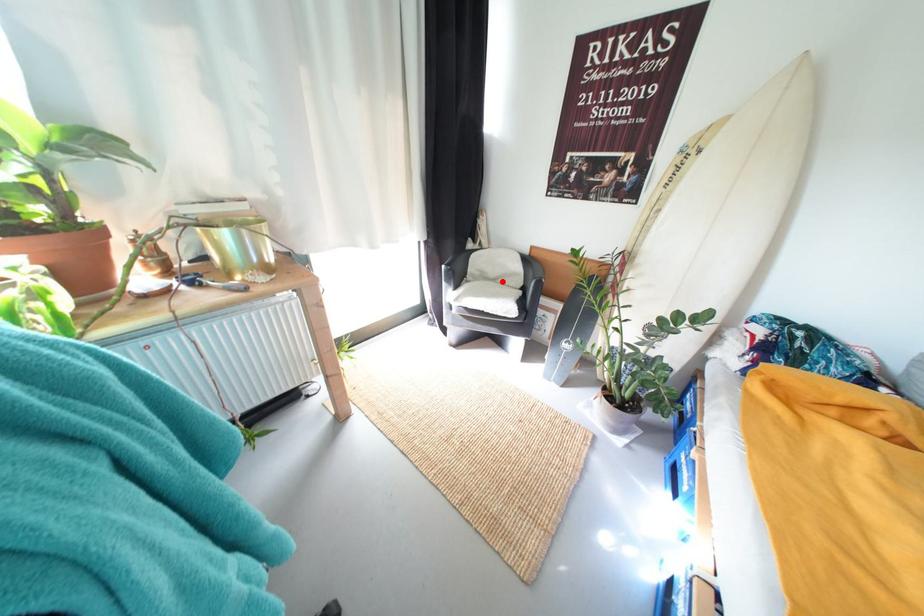
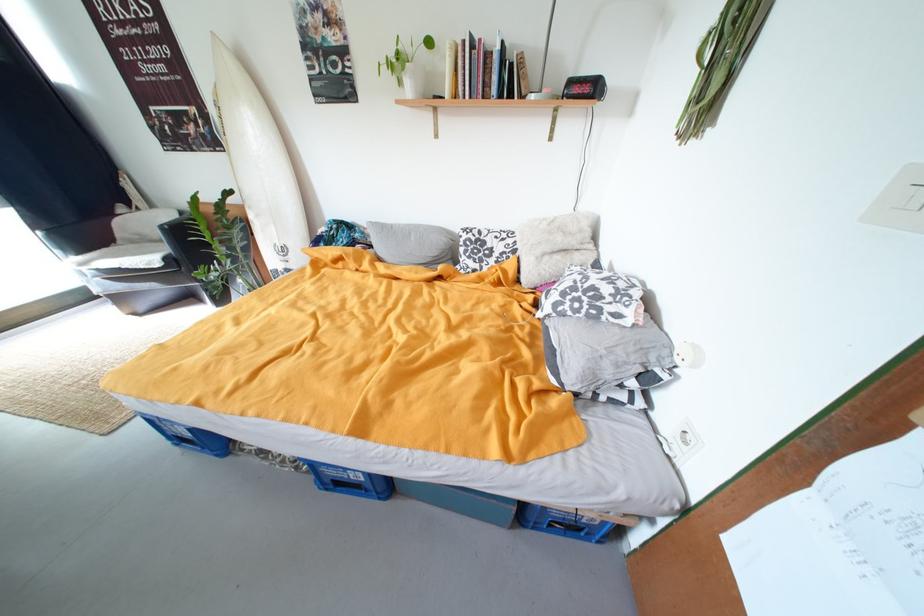
Question: I am providing you with two images of the same scene from different viewpoints. In image1, a red point is highlighted. Considering the same 3D point in image2, which of the following is correct?

Choices:
 (A) It is closer
 (B) It is farther

Answer: (B)